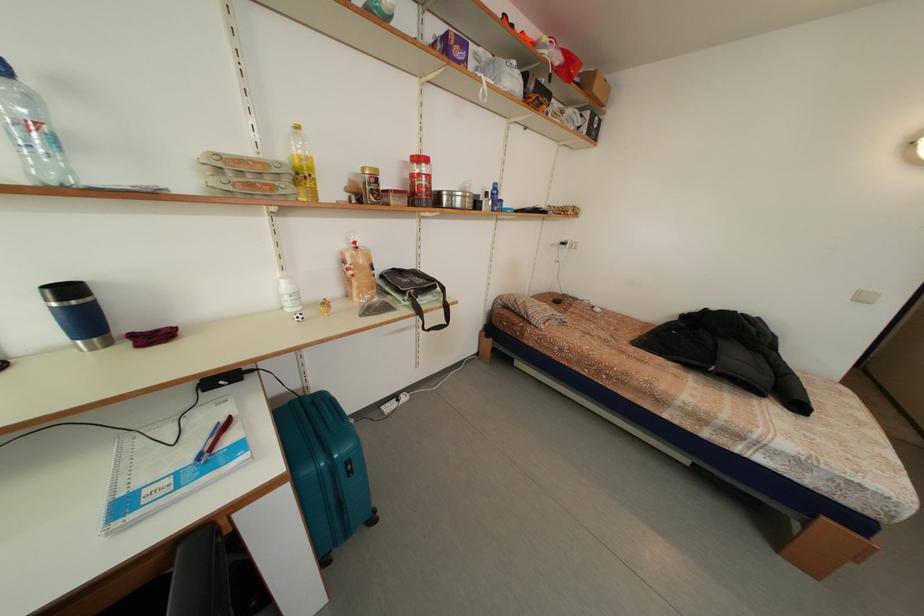
This screenshot has width=924, height=616. What are the coordinates of `white light switch` in the screenshot? It's located at (865, 296).